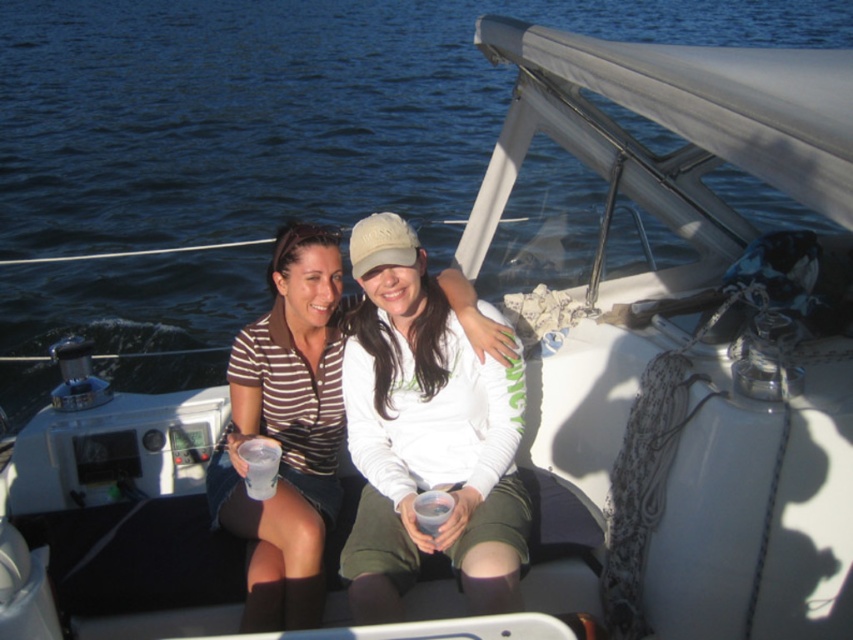
You are a photographer on a boat and want to take a picture of the striped fabric shirt at center. Where should you point your camera to capture it?

You should point your camera to the coordinates at point (x=286, y=442) to capture the striped fabric shirt at center.

You are a photographer on the deck of the sailboat. You want to take a photo of the matte striped shirt at center and the clear plastic cup at center. Which object should you focus on first if you need to adjust the focus from the nearest to the farthest object?

The matte striped shirt at center is taller than the clear plastic cup at center, so you should focus on the clear plastic cup at center first since it is closer to you.